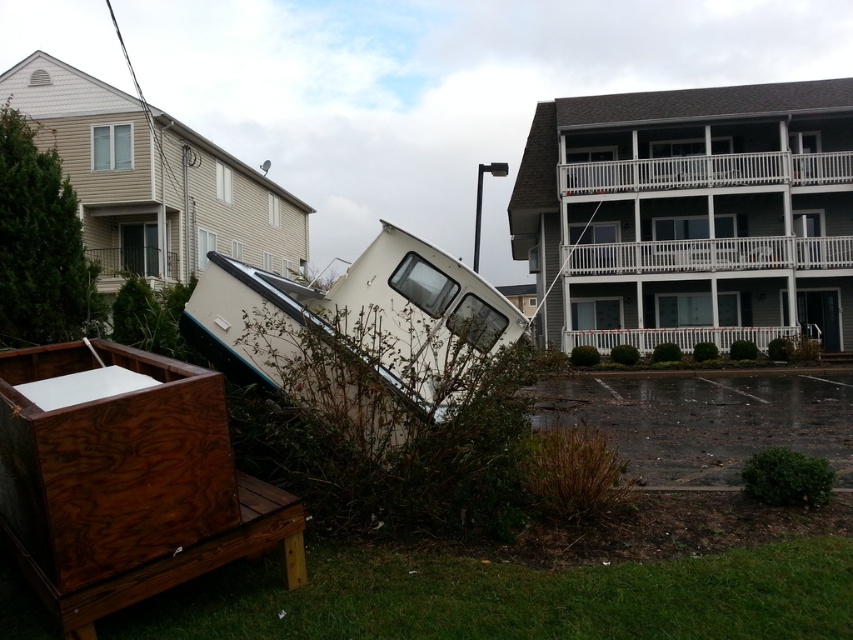
Is wooden crate at lower left positioned at the back of white matte boat at center?

No, it is in front of white matte boat at center.

Who is higher up, wooden crate at lower left or white matte boat at center?

white matte boat at center

The image size is (853, 640). Describe the element at coordinates (126, 481) in the screenshot. I see `wooden crate at lower left` at that location.

Identify the location of wooden crate at lower left. This screenshot has height=640, width=853. (126, 481).